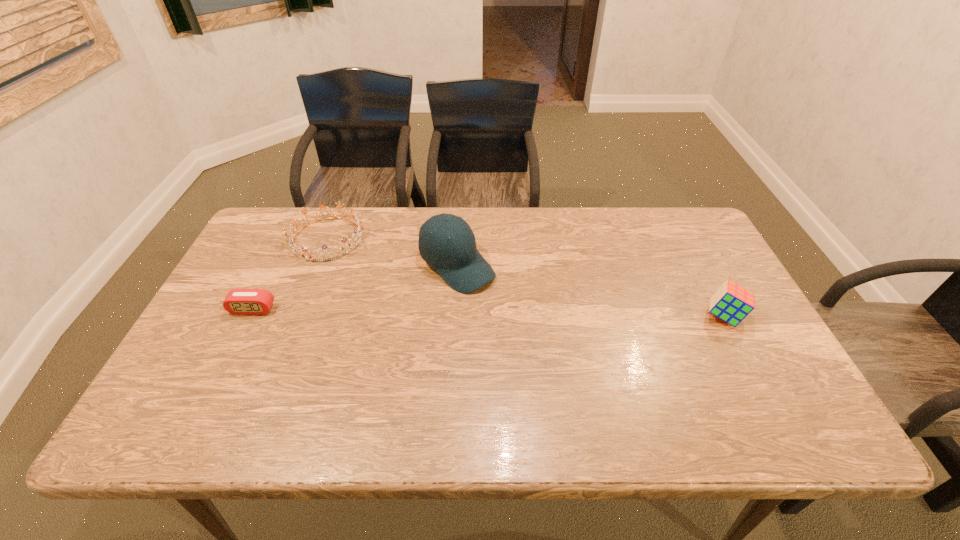
At what (x,y) coordinates should I click in order to perform the action: click on free space that satisfies the following two spatial constraints: 1. on the front-facing side of the alarm clock; 2. on the left side of the cube. Please return your answer as a coordinate pair (x, y). The image size is (960, 540). Looking at the image, I should click on click(x=249, y=316).

Find the location of a particular element. This screenshot has height=540, width=960. blank area in the image that satisfies the following two spatial constraints: 1. on the front side of the second object from right to left; 2. on the left side of the third shortest object is located at coordinates (455, 316).